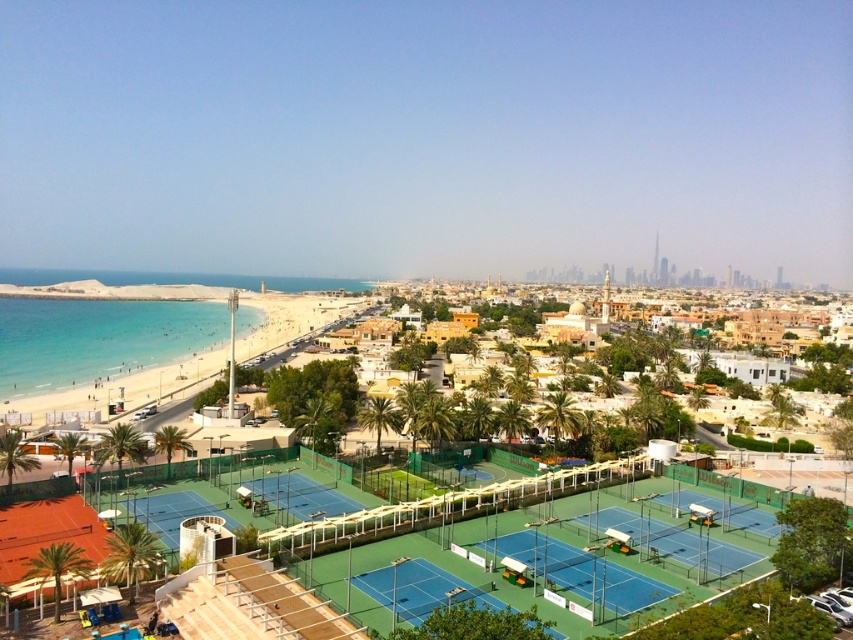
Question: Does smooth sand beach at lower left have a lesser width compared to green synthetic turf tennis courts at center?

Choices:
 (A) no
 (B) yes

Answer: (A)

Question: Among these points, which one is farthest from the camera?

Choices:
 (A) (721, 481)
 (B) (22, 410)
 (C) (608, 588)

Answer: (B)

Question: Is smooth sand beach at lower left wider than green synthetic turf tennis courts at center?

Choices:
 (A) yes
 (B) no

Answer: (A)

Question: Is green synthetic turf tennis courts at center further to camera compared to green synthetic turf tennis court at lower left?

Choices:
 (A) no
 (B) yes

Answer: (B)

Question: Estimate the real-world distances between objects in this image. Which object is closer to the smooth sand beach at lower left?

Choices:
 (A) green synthetic turf tennis court at lower left
 (B) green synthetic turf tennis courts at center

Answer: (A)

Question: Which object is the closest to the smooth sand beach at lower left?

Choices:
 (A) green synthetic turf tennis court at lower left
 (B) green synthetic turf tennis courts at center

Answer: (A)